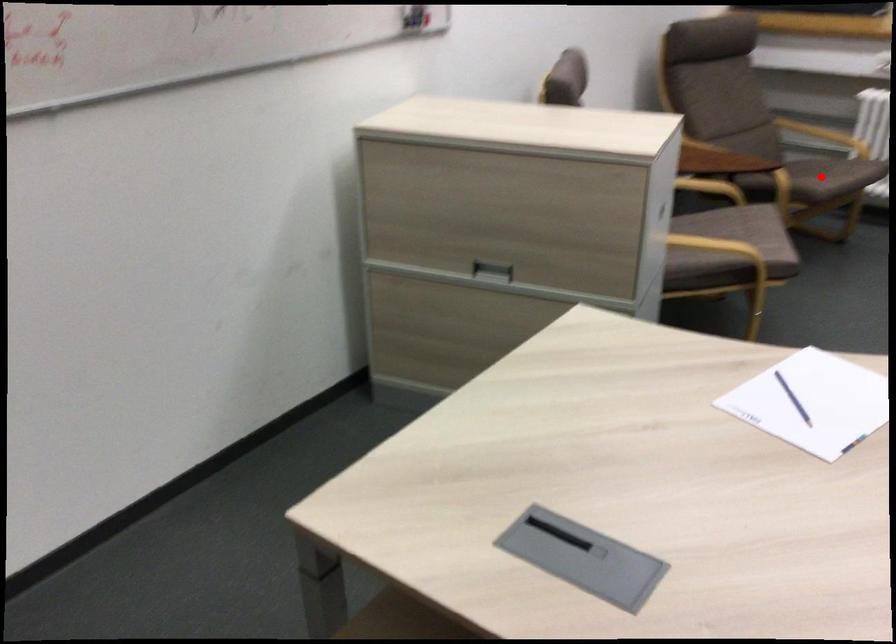
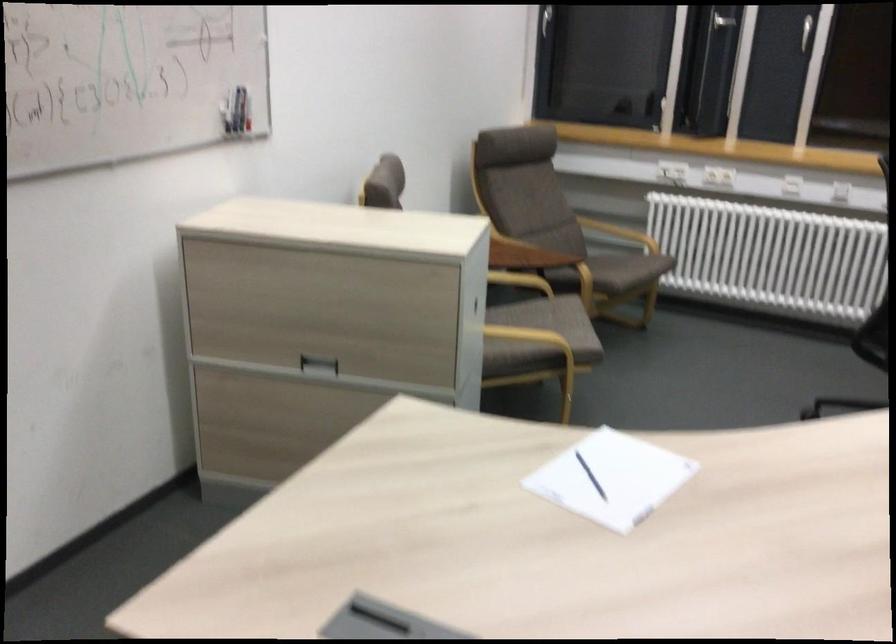
Where in the second image is the point corresponding to the highlighted location from the first image?

(618, 270)